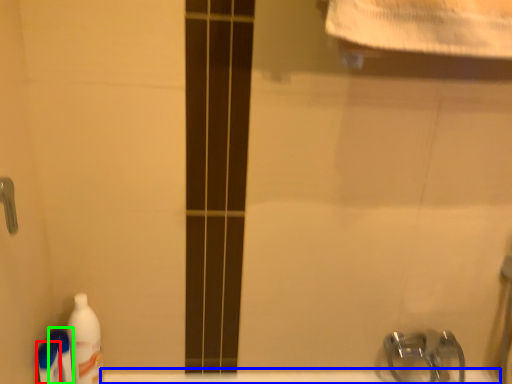
Question: Estimate the real-world distances between objects in this image. Which object is closer to cleaning product (highlighted by a red box), bath (highlighted by a blue box) or cleaning product (highlighted by a green box)?

Choices:
 (A) bath
 (B) cleaning product

Answer: (B)